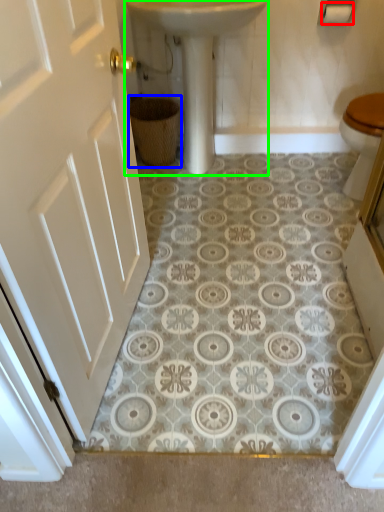
Question: Which object is the farthest from toilet paper (highlighted by a red box)? Choose among these: basket (highlighted by a blue box) or sink (highlighted by a green box).

Choices:
 (A) basket
 (B) sink

Answer: (A)